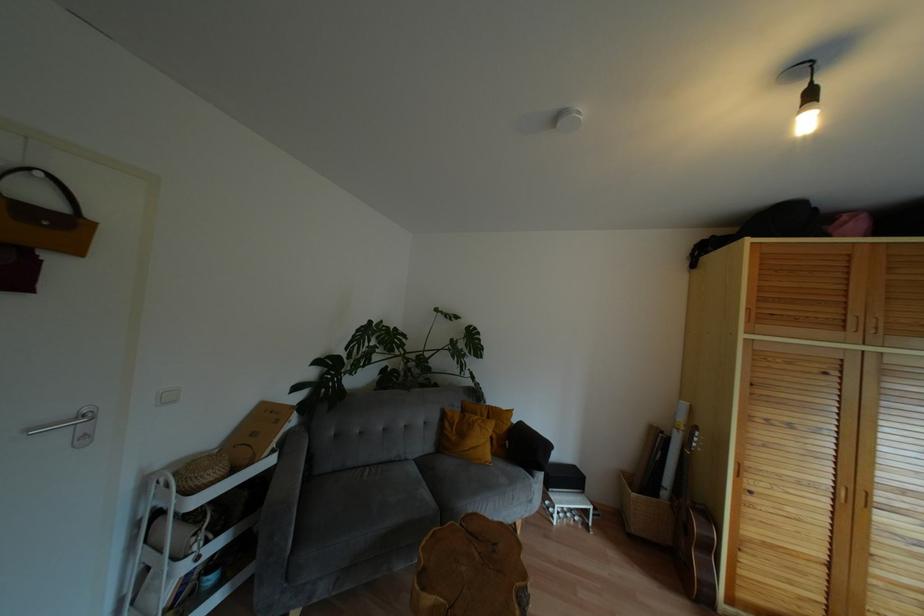
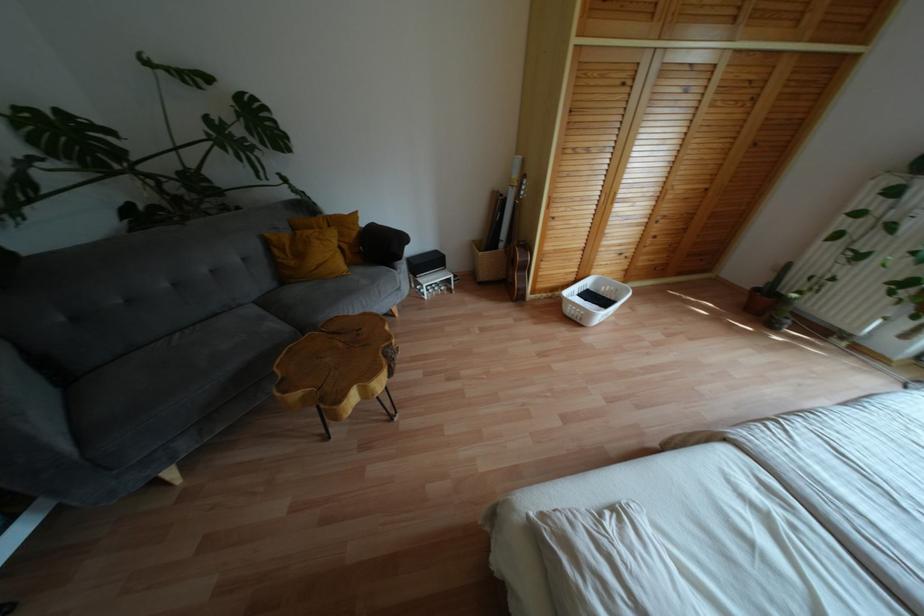
Locate, in the second image, the point that corresponds to [524,448] in the first image.

(380, 246)